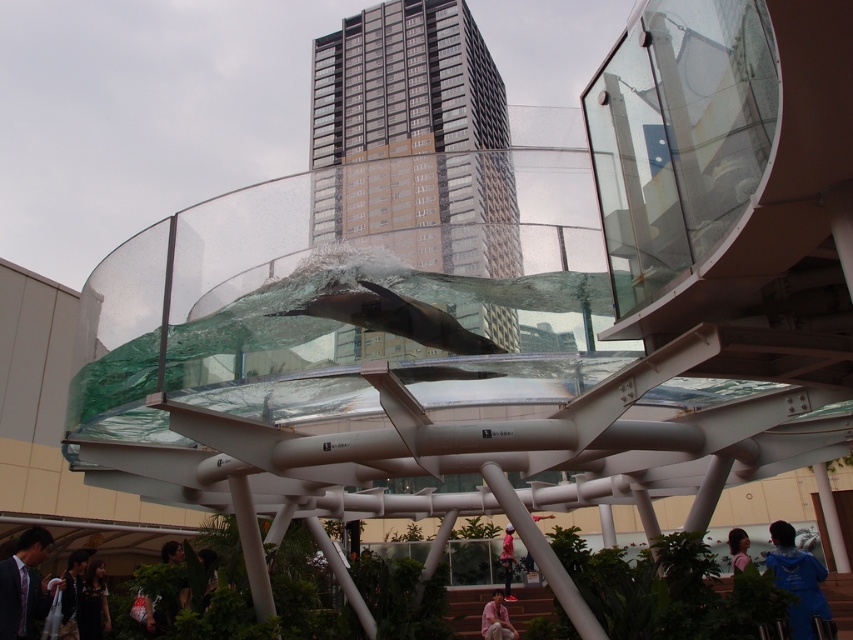
You are a photographer trying to capture a closeup of the dark brown hair at lower center and the light pink fabric at lower center. Which object should you focus on first if you want to ensure both are in focus without adjusting your camera settings?

Since the dark brown hair at lower center is bigger than the light pink fabric at lower center, you should focus on the dark brown hair at lower center first to ensure both are in focus.

From the picture: You are a photographer standing at the base of the installation. You notice two elements at lower center in your viewfinder. Which one is taller between the dark brown hair at lower center and the light pink fabric at lower center?

The dark brown hair at lower center is taller than the light pink fabric at lower center according to the description.